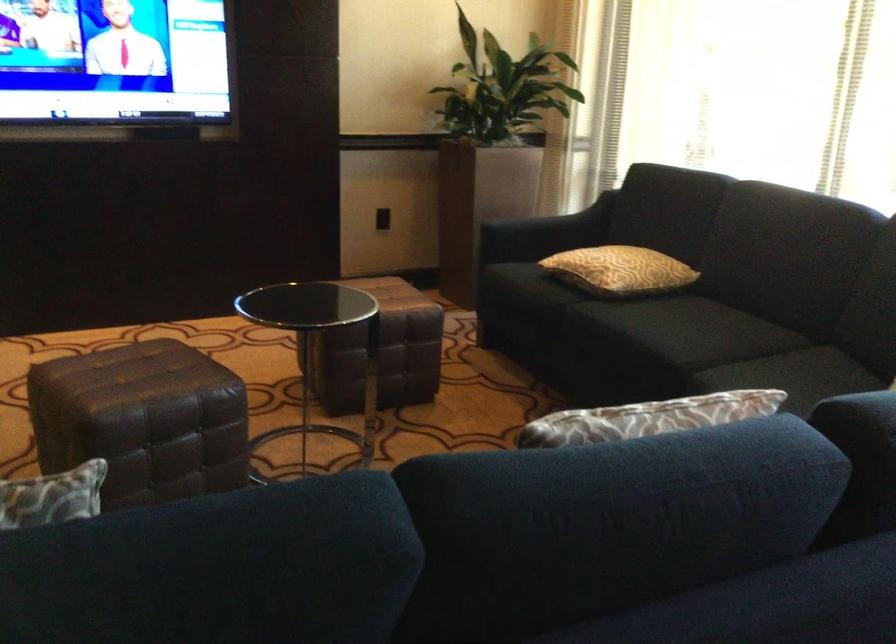
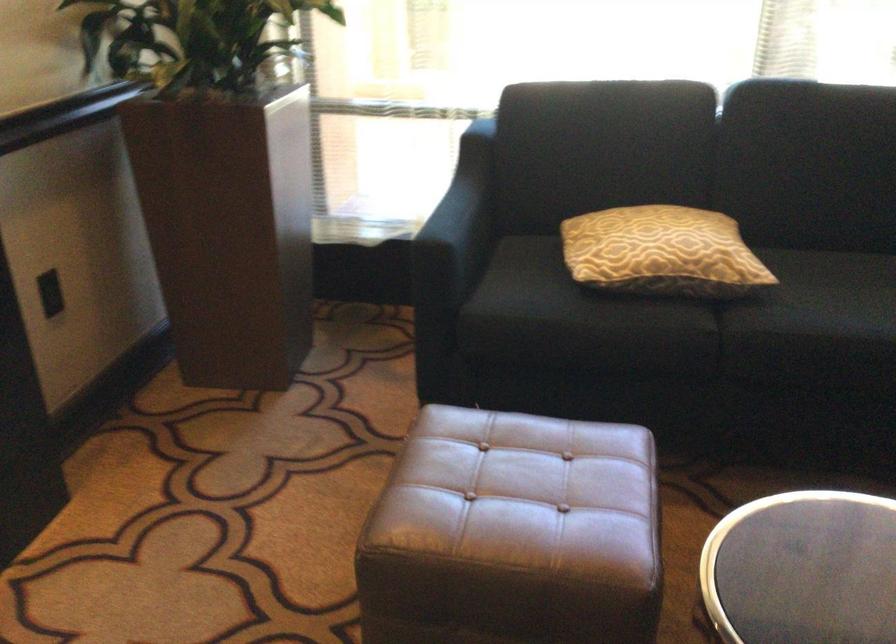
Where in the second image is the point corresponding to point (520, 221) from the first image?

(458, 225)